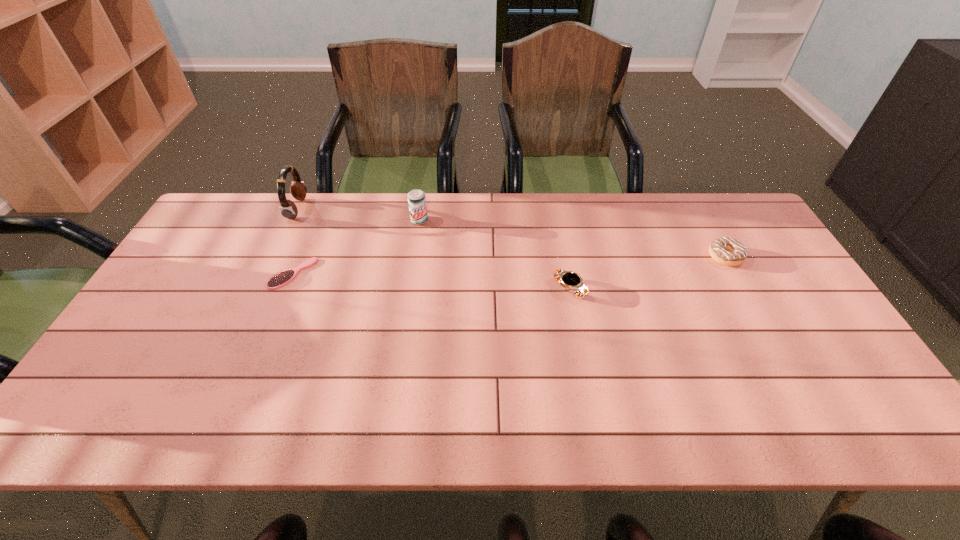
The width and height of the screenshot is (960, 540). I want to click on vacant space in between the shortest object and the tallest object, so click(295, 241).

Locate an element on the screen. free point between the doughnut and the third object from right to left is located at coordinates (572, 239).

You are a GUI agent. You are given a task and a screenshot of the screen. Output one action in this format:
    pyautogui.click(x=<x>, y=<y>)
    Task: Click on the unoccupied area between the shortest object and the second object from right to left
    The image size is (960, 540).
    Given the screenshot: What is the action you would take?
    pyautogui.click(x=431, y=281)

Where is `unoccupied position between the fourth object from left to right and the rightmost object`? The width and height of the screenshot is (960, 540). unoccupied position between the fourth object from left to right and the rightmost object is located at coordinates (647, 273).

Identify the location of vacant space in between the beer can and the hairbrush. (356, 247).

Find the location of a particular element. Image resolution: width=960 pixels, height=540 pixels. free space between the beer can and the tallest object is located at coordinates (358, 215).

Find the location of `blank region between the doughnut and the third object from left to right`. blank region between the doughnut and the third object from left to right is located at coordinates 572,239.

Where is `free space that is in between the second object from right to left and the shortest object`? This screenshot has height=540, width=960. free space that is in between the second object from right to left and the shortest object is located at coordinates (431, 281).

Find the location of a particular element. The width and height of the screenshot is (960, 540). object that is the nearest to the rightmost object is located at coordinates (570, 281).

Find the location of a particular element. The image size is (960, 540). the closest object to the fourth shortest object is located at coordinates (280, 279).